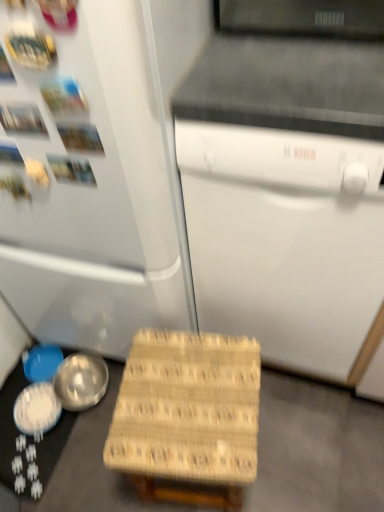
Identify the location of vacant area that is in front of blue matte bowl at lower left, acting as the 3th bowl starting from the right. [x=31, y=434].